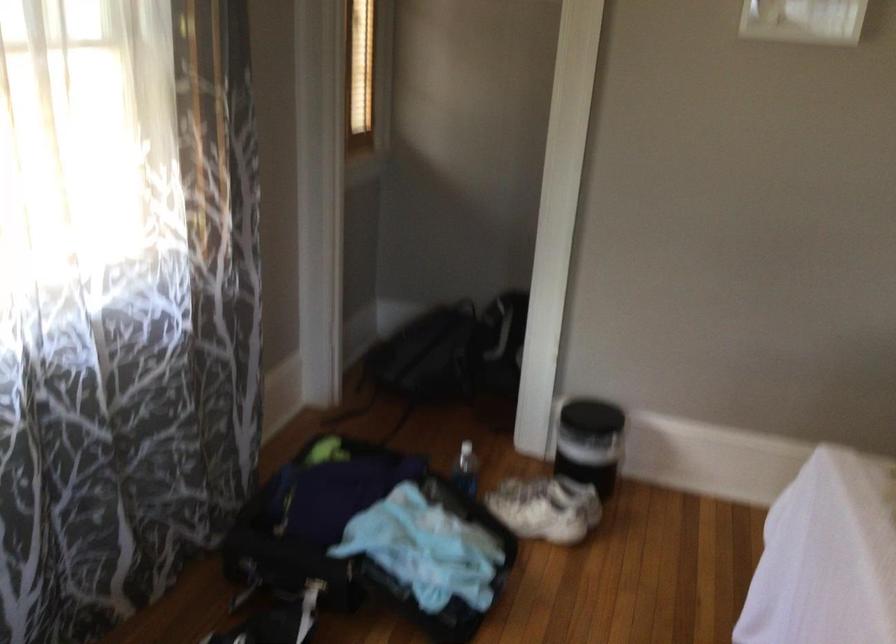
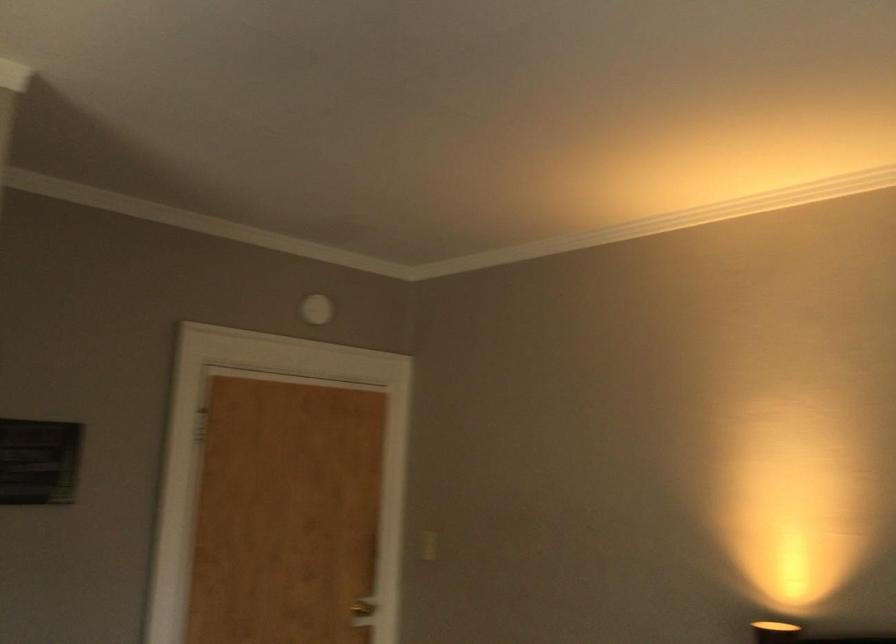
Based on the continuous images, in which direction is the camera rotating?

The camera rotated toward right-up.